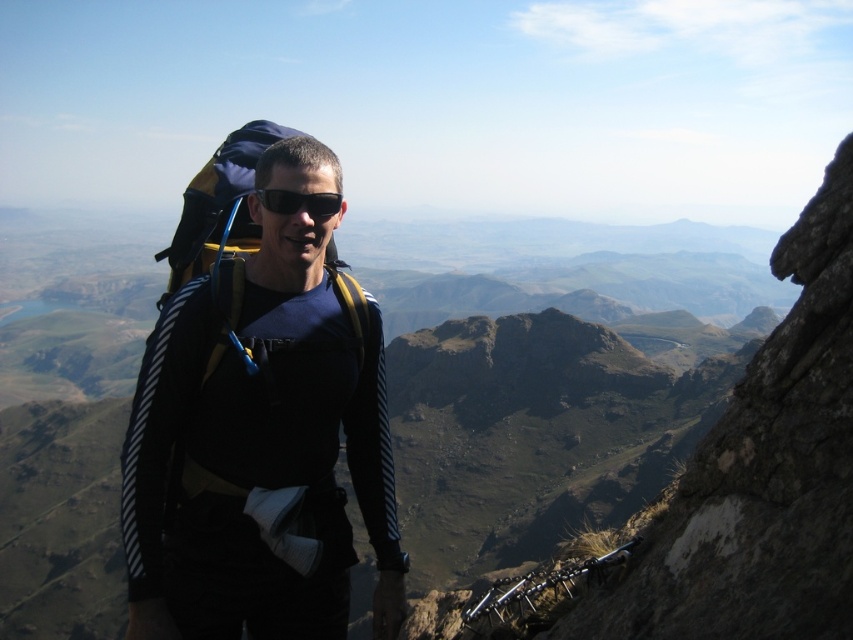
Does black matte backpack at center have a greater width compared to black matte sunglasses at center?

Yes, black matte backpack at center is wider than black matte sunglasses at center.

The height and width of the screenshot is (640, 853). Find the location of `black matte backpack at center`. black matte backpack at center is located at coordinates (258, 448).

The height and width of the screenshot is (640, 853). Identify the location of black matte backpack at center. click(x=258, y=448).